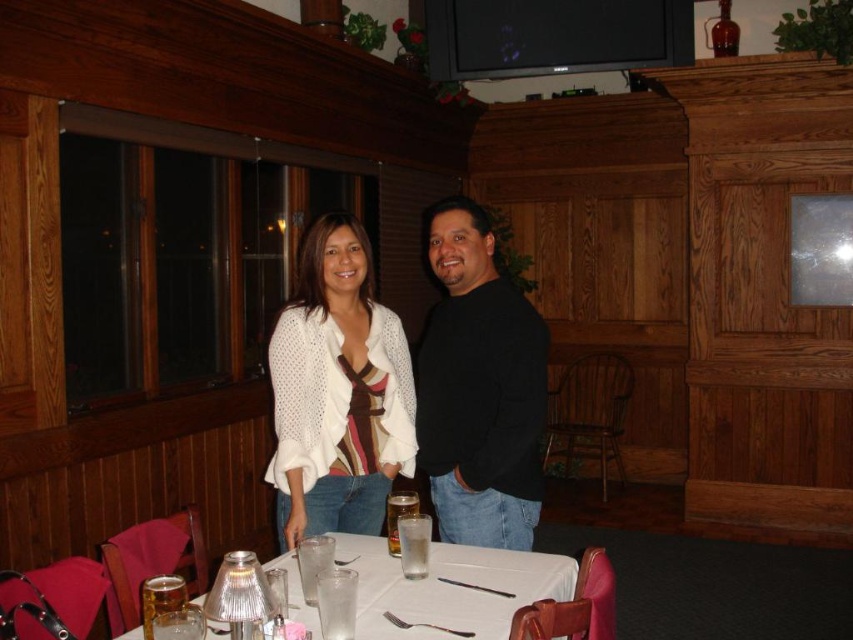
Question: Is white knit cardigan at center above white glossy table at center?

Choices:
 (A) no
 (B) yes

Answer: (B)

Question: Which object is farther from the camera taking this photo?

Choices:
 (A) white glossy table at center
 (B) black matte sweater at center
 (C) white knit cardigan at center

Answer: (C)

Question: Does black matte sweater at center appear on the left side of white glossy table at center?

Choices:
 (A) no
 (B) yes

Answer: (A)

Question: Which object is farther from the camera taking this photo?

Choices:
 (A) black matte sweater at center
 (B) white glossy table at center
 (C) white knit cardigan at center

Answer: (C)

Question: Is white knit cardigan at center closer to camera compared to white glossy table at center?

Choices:
 (A) yes
 (B) no

Answer: (B)

Question: Which is nearer to the white glossy table at center?

Choices:
 (A) black matte sweater at center
 (B) white knit cardigan at center

Answer: (A)